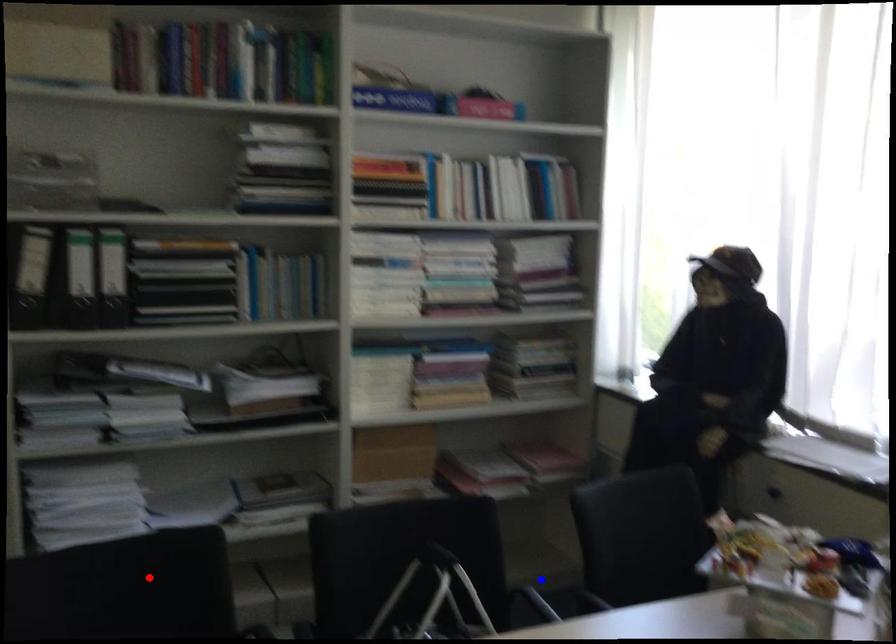
Question: Which of the two points in the image is closer to the camera?

Choices:
 (A) Blue point is closer.
 (B) Red point is closer.

Answer: (B)